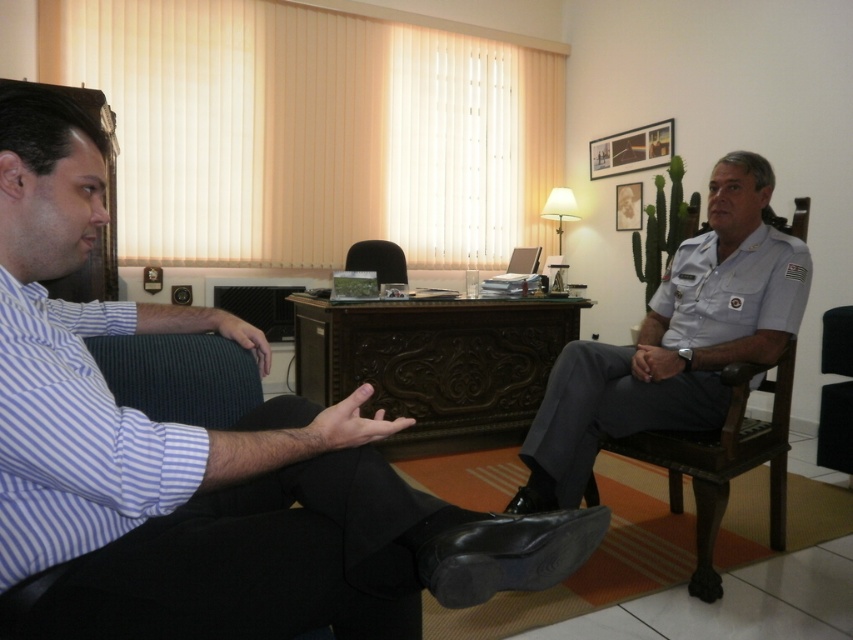
Can you confirm if matte black suit at left is taller than light brown wooden armchair at right?

Indeed, matte black suit at left has a greater height compared to light brown wooden armchair at right.

Which of these two, matte black suit at left or light brown wooden armchair at right, stands shorter?

light brown wooden armchair at right

At what (x,y) coordinates should I click in order to perform the action: click on matte black suit at left. Please return your answer as a coordinate pair (x, y). The image size is (853, 640). Looking at the image, I should click on (202, 460).

Which of these two, light brown wooden armchair at right or black leather armchair at center, stands taller?

With more height is light brown wooden armchair at right.

Describe the element at coordinates (723, 461) in the screenshot. I see `light brown wooden armchair at right` at that location.

Between point (785, 486) and point (393, 278), which one is positioned behind?

Point (393, 278)

Where is `light brown wooden armchair at right`? The width and height of the screenshot is (853, 640). light brown wooden armchair at right is located at coordinates (723, 461).

Does matte black suit at left appear over black leather armchair at center?

No, matte black suit at left is not above black leather armchair at center.

Find the location of a particular element. matte black suit at left is located at coordinates (202, 460).

Which is in front, point (273, 509) or point (378, 244)?

Point (273, 509) is more forward.

Find the location of a particular element. The image size is (853, 640). matte black suit at left is located at coordinates (202, 460).